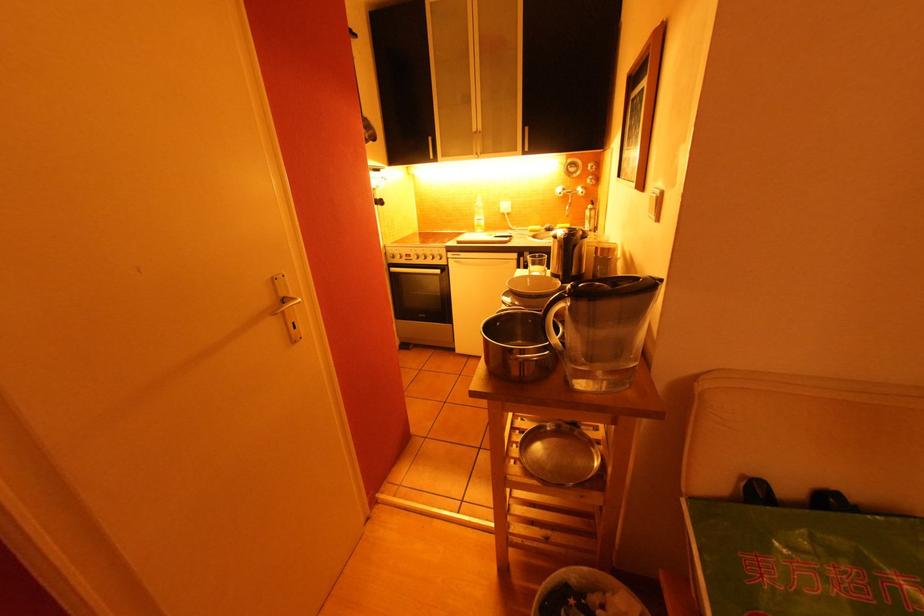
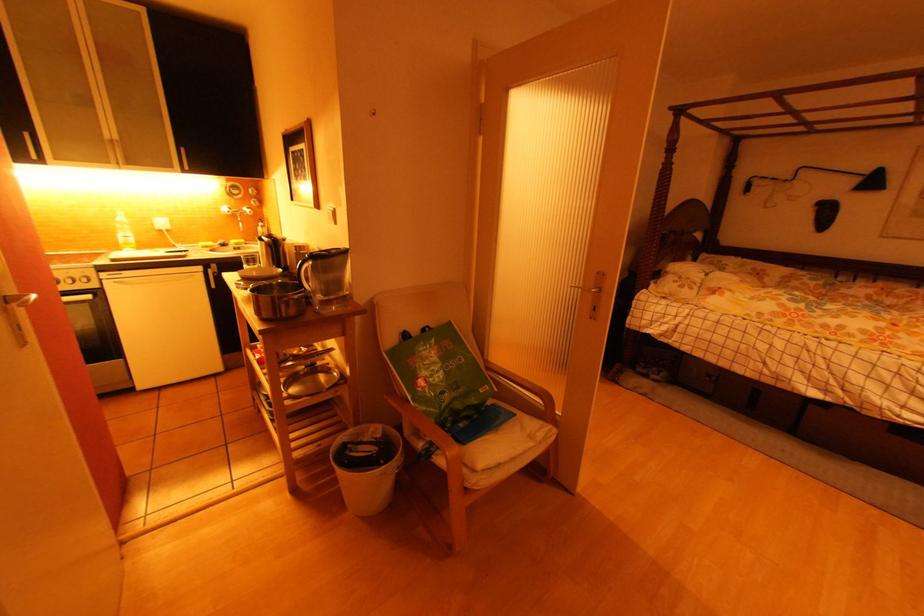
Question: The camera is either moving clockwise (left) or counter-clockwise (right) around the object. The first image is from the beginning of the video and the second image is from the end. Is the camera moving left or right when shooting the video?

Choices:
 (A) Left
 (B) Right

Answer: (A)